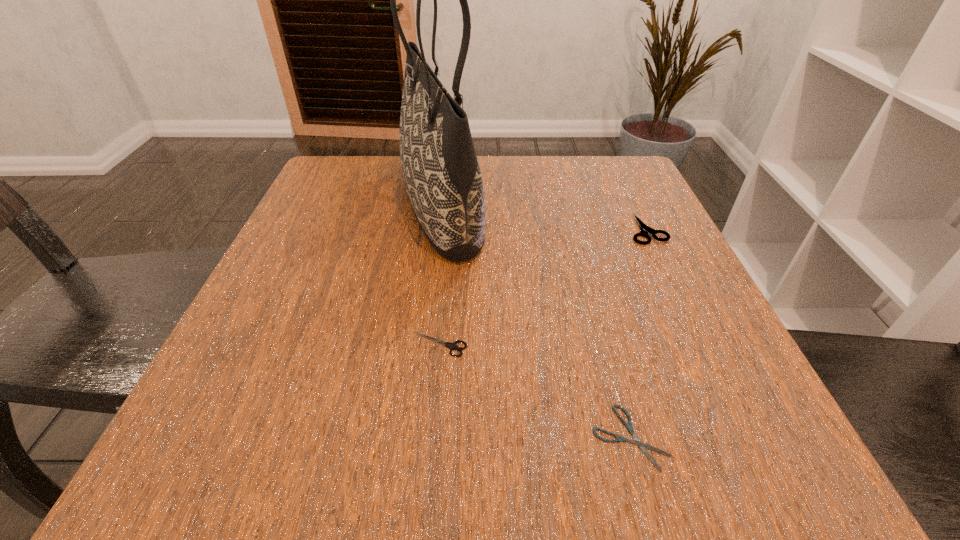
You are a GUI agent. You are given a task and a screenshot of the screen. Output one action in this format:
    pyautogui.click(x=<x>, y=<y>)
    Task: Click on the vacant position located on the left of the second shears from right to left
    Image resolution: width=960 pixels, height=540 pixels.
    Given the screenshot: What is the action you would take?
    [530, 437]

Where is `object that is at the far edge`? object that is at the far edge is located at coordinates (441, 172).

The image size is (960, 540). I want to click on object present at the near edge, so click(x=643, y=446).

You are a GUI agent. You are given a task and a screenshot of the screen. Output one action in this format:
    pyautogui.click(x=<x>, y=<y>)
    Task: Click on the object at the near right corner
    
    Given the screenshot: What is the action you would take?
    pyautogui.click(x=643, y=446)

You are a GUI agent. You are given a task and a screenshot of the screen. Output one action in this format:
    pyautogui.click(x=<x>, y=<y>)
    Task: Click on the free space at the far edge of the desktop
    The image size is (960, 540).
    Given the screenshot: What is the action you would take?
    pyautogui.click(x=501, y=183)

Locate an element on the screen. The width and height of the screenshot is (960, 540). vacant area at the near edge of the desktop is located at coordinates (455, 478).

The image size is (960, 540). Identify the location of free space at the left edge of the desktop. (348, 214).

Identify the location of free spot at the right edge of the desktop. This screenshot has width=960, height=540. (727, 368).

This screenshot has height=540, width=960. I want to click on vacant space at the far left corner of the desktop, so (x=325, y=207).

In the image, there is a desktop. Where is `vacant space at the near left corner`? This screenshot has height=540, width=960. vacant space at the near left corner is located at coordinates (249, 418).